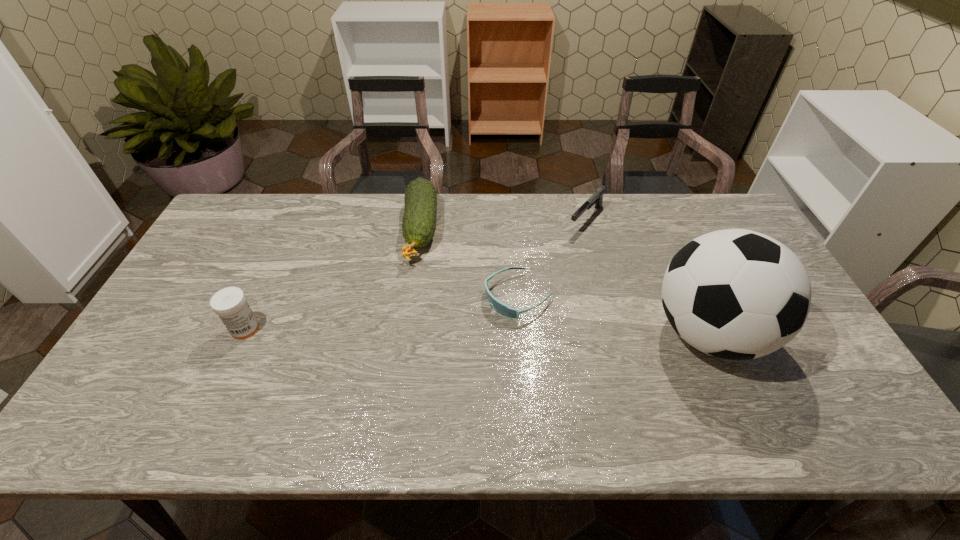
I want to click on free space on the desktop that is between the medicine and the rightmost object and is positioned at the muzzle end of the second object from right to left, so click(x=480, y=331).

Identify the location of free spot on the desktop that is between the medicine and the soccer ball and is positioned on the front-facing side of the shortest object. The image size is (960, 540). 457,331.

Locate an element on the screen. The image size is (960, 540). free spot on the desktop that is between the leftmost object and the rightmost object and is positioned at the blossom end of the fourth object from right to left is located at coordinates (408, 330).